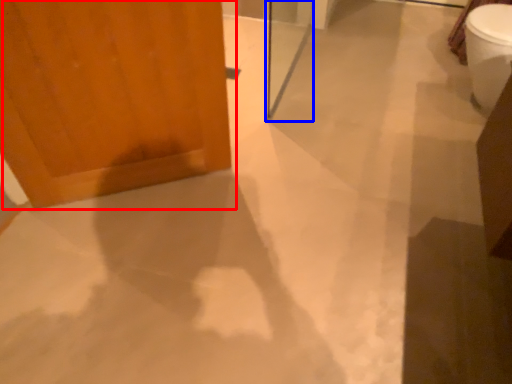
Question: Which of the following is the farthest to the observer, door (highlighted by a red box) or screen door (highlighted by a blue box)?

Choices:
 (A) door
 (B) screen door

Answer: (B)